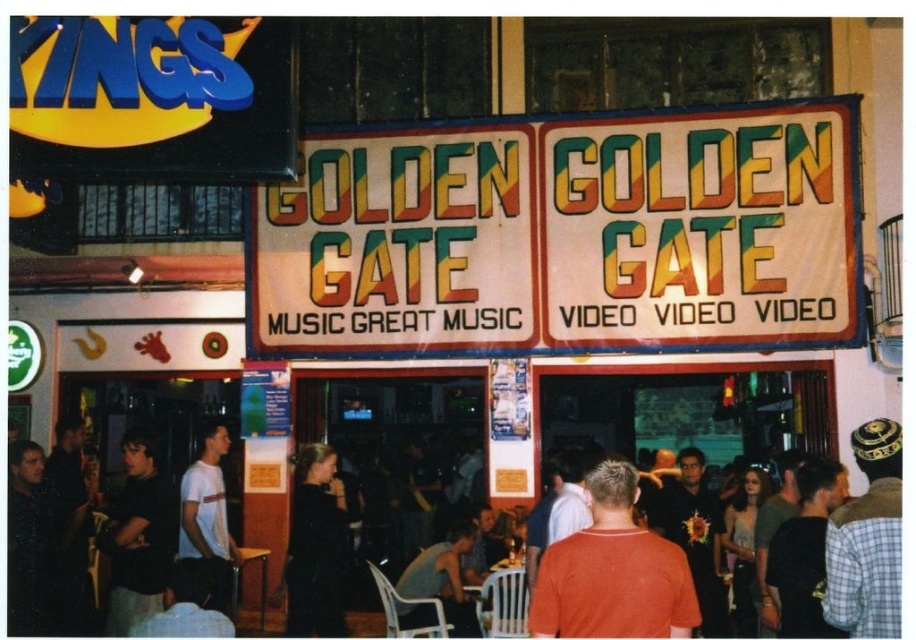
You are a customer entering the Golden Gate store and notice two items displayed in the window. The items are a dark gray shirt at left and a black matte dress at center. Which item appears shorter in the display?

The dark gray shirt at left has a lesser height compared to the black matte dress at center, so the dark gray shirt at left appears shorter.

You are a passerby standing in front of the Golden Gate establishment. You notice the white fabric sign at center and the plaid fabric shirt at right. Which object is bigger in size?

The white fabric sign at center has a larger size compared to the plaid fabric shirt at right.